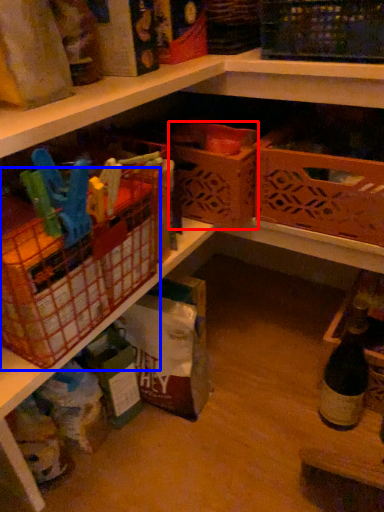
Question: Which of the following is the closest to the observer, basket (highlighted by a red box) or basket (highlighted by a blue box)?

Choices:
 (A) basket
 (B) basket

Answer: (B)